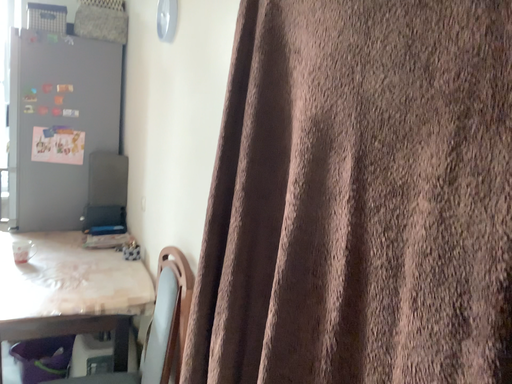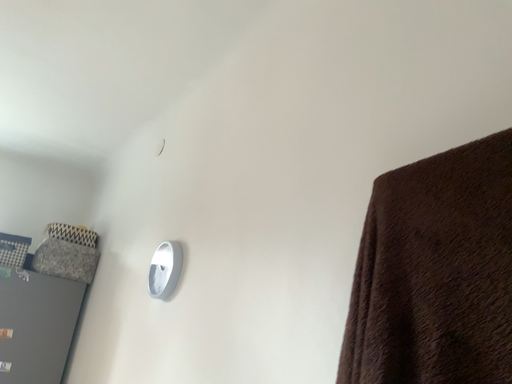
Question: How did the camera likely rotate when shooting the video?

Choices:
 (A) rotated right
 (B) rotated left

Answer: (A)